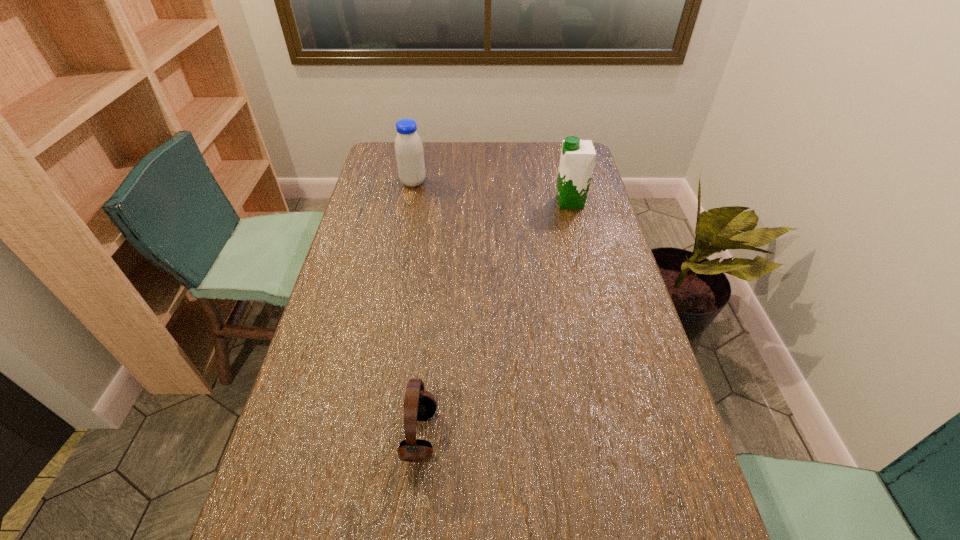
Where is `vacant area that lies between the leftmost object and the second object from right to left`? This screenshot has width=960, height=540. vacant area that lies between the leftmost object and the second object from right to left is located at coordinates (417, 309).

Find the location of a particular element. Image resolution: width=960 pixels, height=540 pixels. empty location between the nearer soya milk and the farther soya milk is located at coordinates (492, 192).

Identify which object is the second nearest to the farther soya milk. Please provide its 2D coordinates. Your answer should be formatted as a tuple, i.e. [(x, y)], where the tuple contains the x and y coordinates of a point satisfying the conditions above.

[(419, 405)]

Locate an element on the screen. object that ranks as the closest to the nearer soya milk is located at coordinates (409, 152).